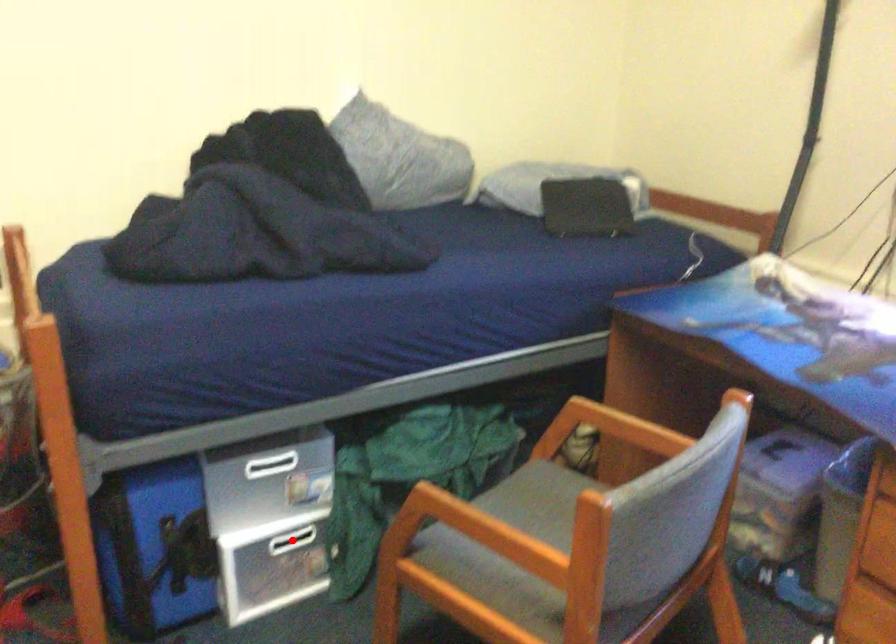
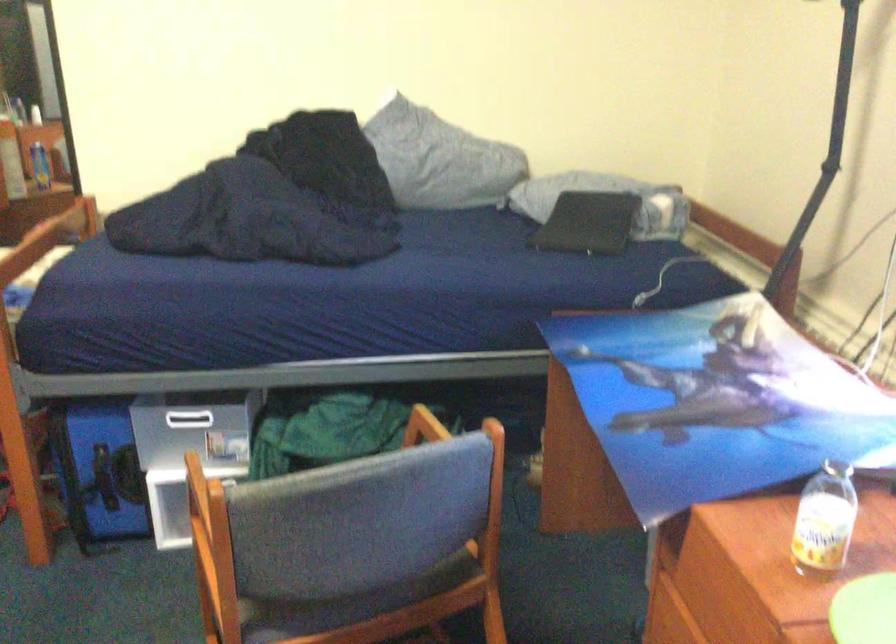
Question: I am providing you with two images of the same scene from different viewpoints. A red point is marked on the first image. Can you still see the location of the red point in image 2?

Choices:
 (A) Yes
 (B) No

Answer: (B)